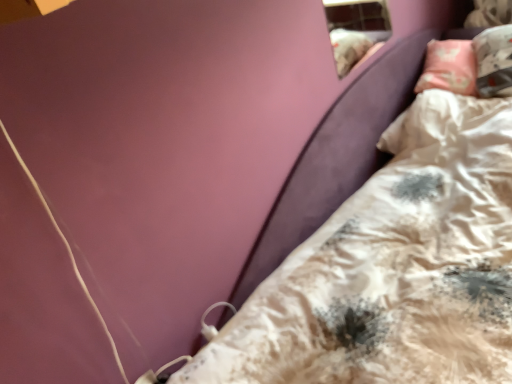
The height and width of the screenshot is (384, 512). Describe the element at coordinates (393, 268) in the screenshot. I see `velvet purple bed at lower right` at that location.

Where is `velvet purple bed at lower right`? velvet purple bed at lower right is located at coordinates (393, 268).

This screenshot has width=512, height=384. Identify the location of transparent glass window at upper right. (355, 29).

Measure the distance between transparent glass window at upper right and camera.

The depth of transparent glass window at upper right is 1.88 meters.

This screenshot has width=512, height=384. What do you see at coordinates (355, 29) in the screenshot? I see `transparent glass window at upper right` at bounding box center [355, 29].

Find the location of a particular element. velvet purple bed at lower right is located at coordinates (393, 268).

Is velvet purple bed at lower right at the left side of transparent glass window at upper right?

No, velvet purple bed at lower right is not to the left of transparent glass window at upper right.

Is the depth of velvet purple bed at lower right greater than that of transparent glass window at upper right?

No, velvet purple bed at lower right is in front of transparent glass window at upper right.

Is point (419, 112) behind point (337, 72)?

Yes, point (419, 112) is behind point (337, 72).

From the image's perspective, which object appears higher, velvet purple bed at lower right or transparent glass window at upper right?

From the image's view, transparent glass window at upper right is above.

From a real-world perspective, is velvet purple bed at lower right above or below transparent glass window at upper right?

velvet purple bed at lower right is situated lower than transparent glass window at upper right in the real world.

Which object is thinner, velvet purple bed at lower right or transparent glass window at upper right?

transparent glass window at upper right is thinner.

In the scene shown: Who is taller, velvet purple bed at lower right or transparent glass window at upper right?

transparent glass window at upper right.

Is velvet purple bed at lower right bigger than transparent glass window at upper right?

Yes.

Is velvet purple bed at lower right located outside transparent glass window at upper right?

Indeed, velvet purple bed at lower right is completely outside transparent glass window at upper right.

Are velvet purple bed at lower right and transparent glass window at upper right far apart?

That's not correct — velvet purple bed at lower right is a little close to transparent glass window at upper right.

In the scene shown: Is velvet purple bed at lower right oriented away from transparent glass window at upper right?

No, transparent glass window at upper right is not at the back of velvet purple bed at lower right.

How many degrees apart are the facing directions of velvet purple bed at lower right and transparent glass window at upper right?

velvet purple bed at lower right and transparent glass window at upper right are facing 89.4 degrees away from each other.

Identify the location of window on the left side of velvet purple bed at lower right. (355, 29).

Considering the positions of objects transparent glass window at upper right and velvet purple bed at lower right in the image provided, who is more to the right, transparent glass window at upper right or velvet purple bed at lower right?

velvet purple bed at lower right is more to the right.

Is transparent glass window at upper right further to camera compared to velvet purple bed at lower right?

Yes, it is.

Is point (332, 6) closer or farther from the camera than point (487, 306)?

Point (332, 6) appears to be farther away from the viewer than point (487, 306).

From the image's perspective, is transparent glass window at upper right above or below velvet purple bed at lower right?

From the image's perspective, transparent glass window at upper right appears above velvet purple bed at lower right.

From a real-world perspective, which is physically below, transparent glass window at upper right or velvet purple bed at lower right?

From a 3D spatial view, velvet purple bed at lower right is below.

In terms of width, does transparent glass window at upper right look wider or thinner when compared to velvet purple bed at lower right?

transparent glass window at upper right is thinner than velvet purple bed at lower right.

From the picture: Is transparent glass window at upper right taller or shorter than velvet purple bed at lower right?

transparent glass window at upper right is taller than velvet purple bed at lower right.

Looking at the image, does transparent glass window at upper right seem bigger or smaller compared to velvet purple bed at lower right?

transparent glass window at upper right is smaller than velvet purple bed at lower right.

Is velvet purple bed at lower right completely or partially inside transparent glass window at upper right?

That's incorrect, velvet purple bed at lower right is not inside transparent glass window at upper right.

Is there a large distance between transparent glass window at upper right and velvet purple bed at lower right?

No, transparent glass window at upper right is not far from velvet purple bed at lower right.

Is transparent glass window at upper right looking in the opposite direction of velvet purple bed at lower right?

transparent glass window at upper right is not turned away from velvet purple bed at lower right.

The width and height of the screenshot is (512, 384). In order to click on window that appears on the left of velvet purple bed at lower right in this screenshot , I will do `click(355, 29)`.

What are the coordinates of `window above the velvet purple bed at lower right (from the image's perspective)` in the screenshot? It's located at click(x=355, y=29).

Locate an element on the screen. The height and width of the screenshot is (384, 512). bed below the transparent glass window at upper right (from a real-world perspective) is located at coordinates (393, 268).